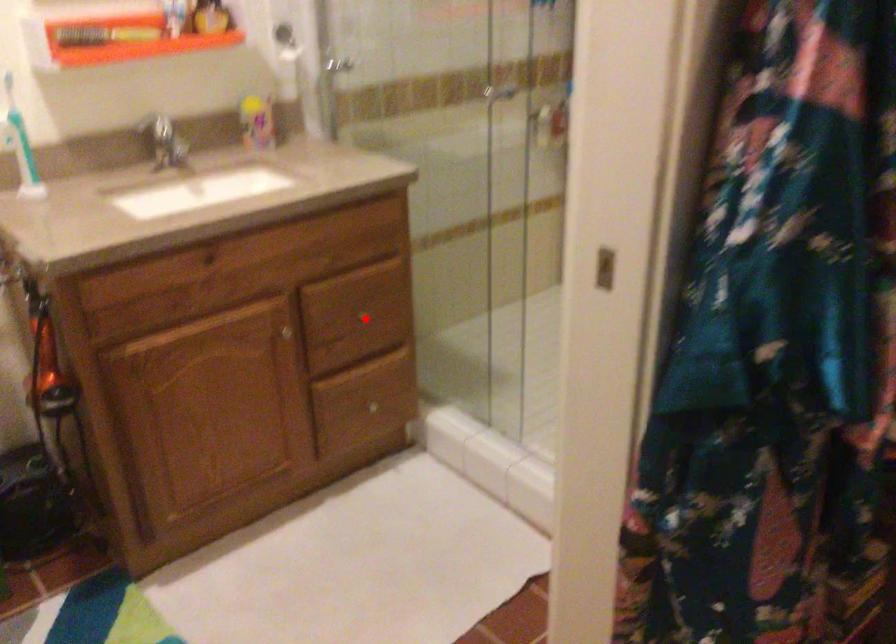
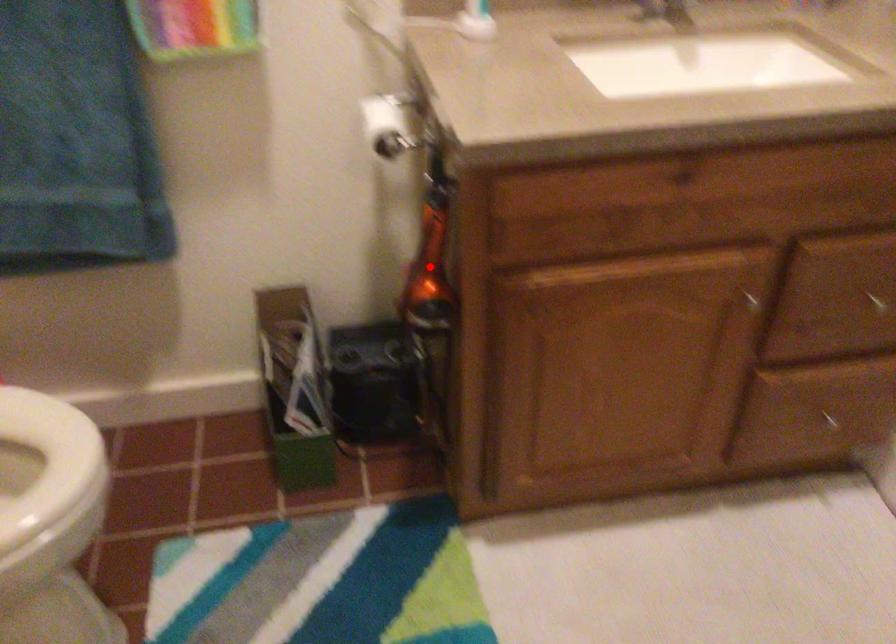
I am providing you with two images of the same scene from different viewpoints. A red point is marked on the first image and another point is marked on the second image. Is the red point in image1 aligned with the point shown in image2?

No